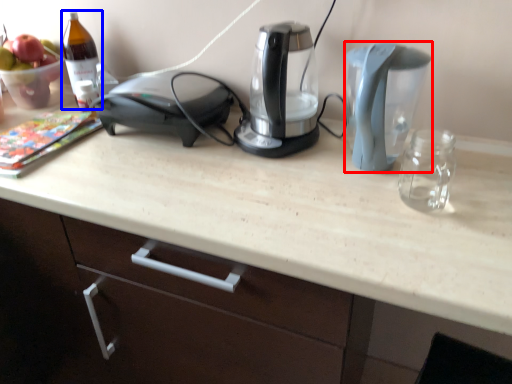
Question: Which point is closer to the camera, kitchen appliance (highlighted by a red box) or wine bottle (highlighted by a blue box)?

Choices:
 (A) kitchen appliance
 (B) wine bottle

Answer: (A)